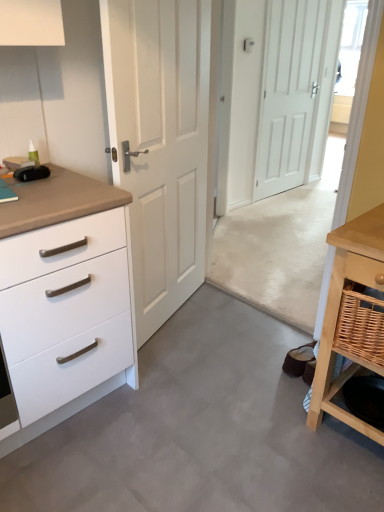
Question: Does gray laminate floor at center contain light wood table at lower right?

Choices:
 (A) yes
 (B) no

Answer: (B)

Question: From the image's perspective, is gray laminate floor at center beneath light wood table at lower right?

Choices:
 (A) yes
 (B) no

Answer: (A)

Question: Is gray laminate floor at center bigger than light wood table at lower right?

Choices:
 (A) yes
 (B) no

Answer: (B)

Question: Are gray laminate floor at center and light wood table at lower right beside each other?

Choices:
 (A) no
 (B) yes

Answer: (A)

Question: Does gray laminate floor at center have a lesser width compared to light wood table at lower right?

Choices:
 (A) yes
 (B) no

Answer: (B)

Question: Is light wood table at lower right at the back of gray laminate floor at center?

Choices:
 (A) yes
 (B) no

Answer: (B)

Question: Can you confirm if woven brown basket at lower right is positioned to the right of white matte door at center, the first door in the back-to-front sequence?

Choices:
 (A) no
 (B) yes

Answer: (A)

Question: Is woven brown basket at lower right next to white matte door at center, positioned as the second door in front-to-back order?

Choices:
 (A) yes
 (B) no

Answer: (B)

Question: From the image's perspective, would you say woven brown basket at lower right is positioned over white matte door at center, placed as the 2th door when sorted from left to right?

Choices:
 (A) yes
 (B) no

Answer: (B)

Question: Is woven brown basket at lower right completely or partially outside of white matte door at center, the first door in the back-to-front sequence?

Choices:
 (A) no
 (B) yes

Answer: (B)

Question: Is woven brown basket at lower right positioned in front of white matte door at center, the first door in the back-to-front sequence?

Choices:
 (A) yes
 (B) no

Answer: (A)

Question: Is woven brown basket at lower right oriented away from white matte door at center, positioned as the second door in front-to-back order?

Choices:
 (A) no
 (B) yes

Answer: (A)

Question: Is white matte chest of drawers at left oriented away from white matte door at center, the first door viewed from the right?

Choices:
 (A) yes
 (B) no

Answer: (B)